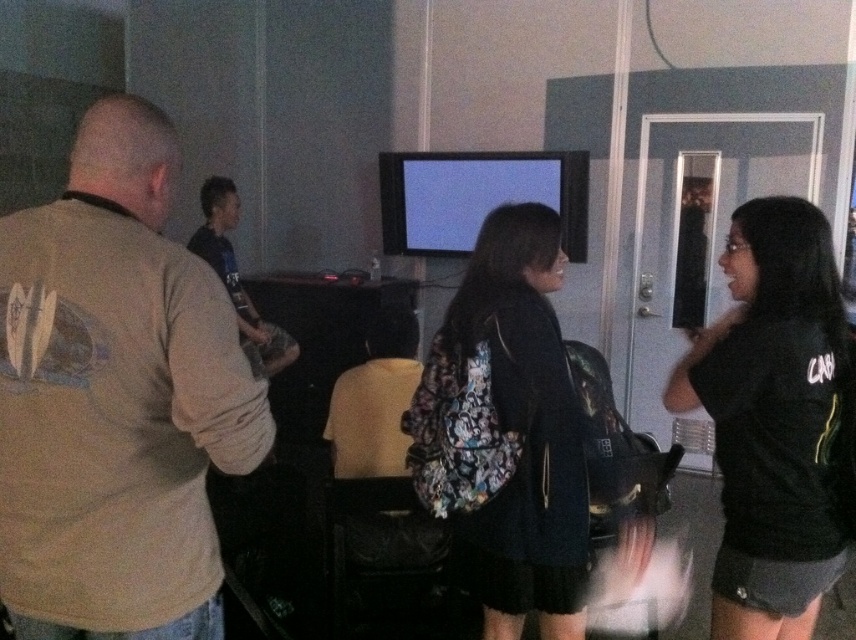
Who is positioned more to the left, beige cotton shirt at left or black matte shirt at right?

beige cotton shirt at left

Can you confirm if beige cotton shirt at left is wider than black matte shirt at right?

Yes.

You are a GUI agent. You are given a task and a screenshot of the screen. Output one action in this format:
    pyautogui.click(x=<x>, y=<y>)
    Task: Click on the beige cotton shirt at left
    
    Given the screenshot: What is the action you would take?
    pyautogui.click(x=116, y=397)

Which is more to the left, beige cotton shirt at left or floral-patterned backpack at center?

Positioned to the left is beige cotton shirt at left.

Can you confirm if beige cotton shirt at left is positioned to the right of floral-patterned backpack at center?

Incorrect, beige cotton shirt at left is not on the right side of floral-patterned backpack at center.

In order to click on beige cotton shirt at left in this screenshot , I will do `click(116, 397)`.

Image resolution: width=856 pixels, height=640 pixels. What are the coordinates of `beige cotton shirt at left` in the screenshot? It's located at (116, 397).

Between floral-patterned backpack at center and matte black shirt at center, which one has less height?

matte black shirt at center

Is point (503, 582) less distant than point (235, 209)?

Yes.

Locate an element on the screen. This screenshot has width=856, height=640. floral-patterned backpack at center is located at coordinates (507, 432).